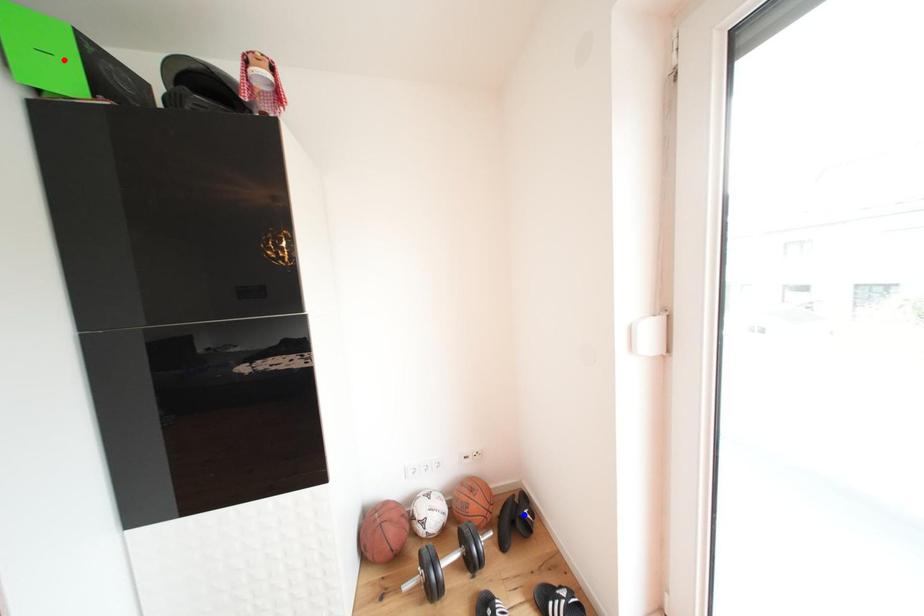
Question: Two points are marked on the image. Which point is closer to the camera?

Choices:
 (A) Blue point is closer.
 (B) Red point is closer.

Answer: (B)